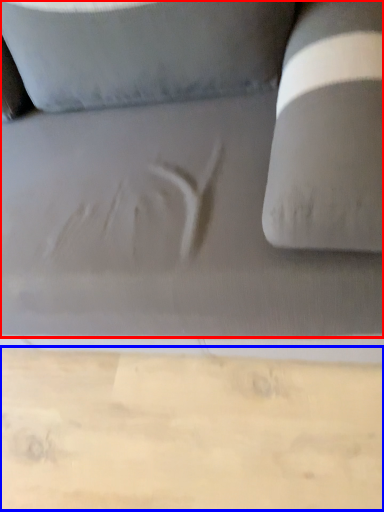
Question: Which object appears farthest to the camera in this image, studio couch (highlighted by a red box) or cardboard (highlighted by a blue box)?

Choices:
 (A) studio couch
 (B) cardboard

Answer: (B)